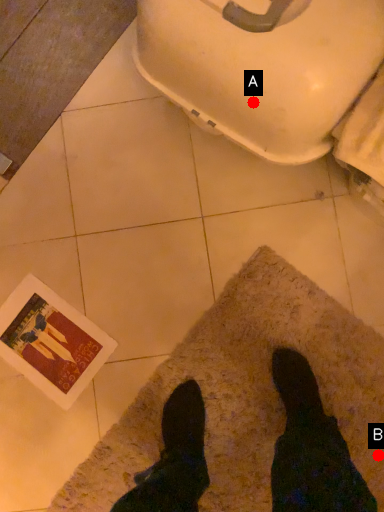
Question: Two points are circled on the image, labeled by A and B beside each circle. Which point is further to the camera?

Choices:
 (A) A is further
 (B) B is further

Answer: (B)